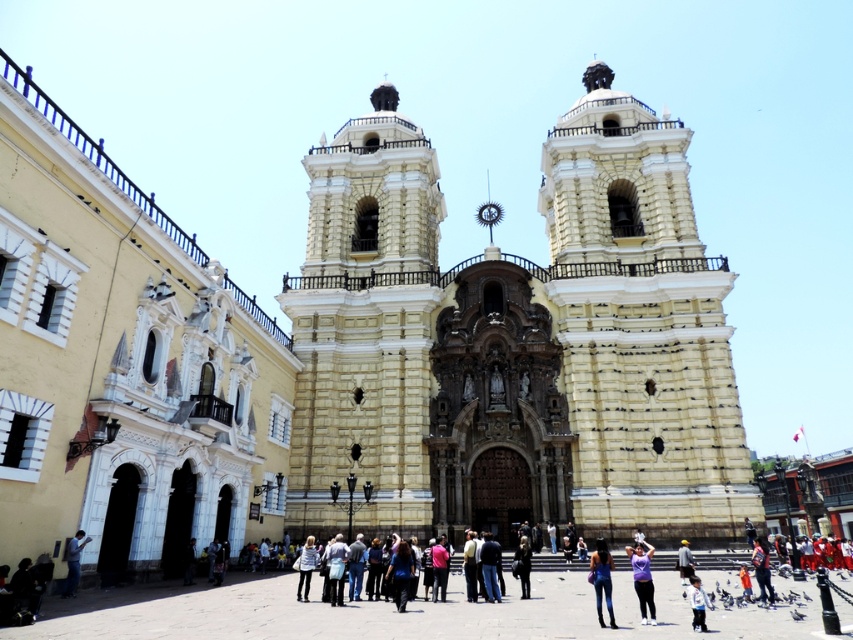
You are standing in the plaza in front of the church and see both the purple matte shirt at lower center and the white cotton shirt at center. Which person is closer to you?

The purple matte shirt at lower center is closer to you because it is further to the viewer than the white cotton shirt at center.

You are a photographer trying to capture the church facade. You notice two items at the center of the scene, a pink fabric and a white cotton shirt. Which item is closer to the camera, the pink fabric at center or the white cotton shirt at center?

The pink fabric at center is positioned under the white cotton shirt at center, so the white cotton shirt at center is closer to the camera.

You are standing in the plaza in front of the church and see two people wearing denim clothing. One is wearing blue denim jeans at lower center and the other is wearing denim pants at lower left. Which person is closer to you?

The blue denim jeans at lower center is closer to you because it is further to the viewer than denim pants at lower left, meaning it appears nearer in the image.